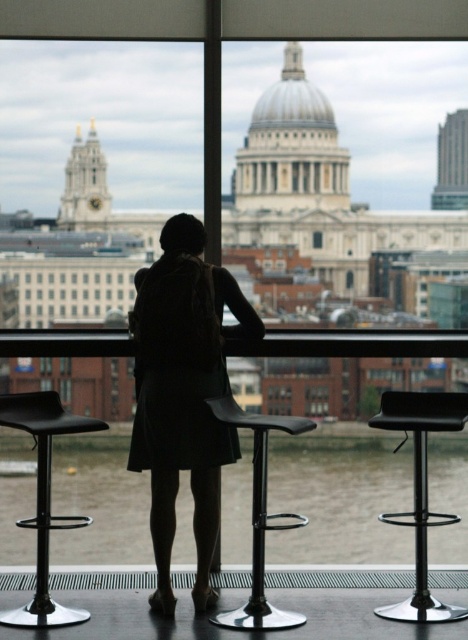
Consider the image. Is black leather bar stool at center to the left of black plastic bar stool at lower left from the viewer's perspective?

Incorrect, black leather bar stool at center is not on the left side of black plastic bar stool at lower left.

Is black leather bar stool at center behind black plastic bar stool at lower left?

Yes, black leather bar stool at center is behind black plastic bar stool at lower left.

Find the location of `black leather bar stool at center`. black leather bar stool at center is located at coordinates (421, 492).

This screenshot has width=468, height=640. I want to click on black leather bar stool at center, so click(421, 492).

Looking at this image, which is more to the left, black fabric coat at center or black matte bar stool at center?

From the viewer's perspective, black fabric coat at center appears more on the left side.

Can you confirm if black fabric coat at center is thinner than black matte bar stool at center?

No, black fabric coat at center is not thinner than black matte bar stool at center.

Which is in front, point (180, 326) or point (238, 417)?

Positioned in front is point (238, 417).

In order to click on black fabric coat at center in this screenshot , I will do `click(183, 394)`.

Describe the element at coordinates (183, 394) in the screenshot. I see `black fabric coat at center` at that location.

Based on the photo, which is below, black fabric coat at center or black plastic bar stool at lower left?

Positioned lower is black plastic bar stool at lower left.

You are a GUI agent. You are given a task and a screenshot of the screen. Output one action in this format:
    pyautogui.click(x=<x>, y=<y>)
    Task: Click on the black fabric coat at center
    
    Given the screenshot: What is the action you would take?
    (x=183, y=394)